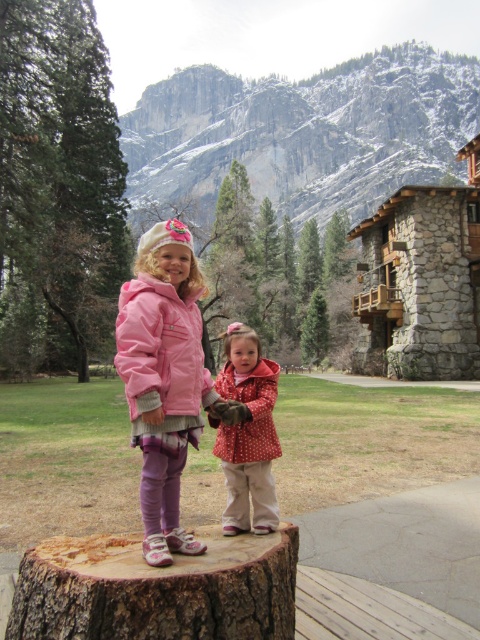
You are a photographer trying to capture a photo of the brown rough tree stump at lower center and the polka dot fabric jacket at center. Based on their heights, which object should you focus on first if you want to ensure both are in frame without adjusting your camera angle?

The brown rough tree stump at lower center is shorter than the polka dot fabric jacket at center, so you should focus on the polka dot fabric jacket at center first to ensure both are in frame.

You are a photographer trying to capture a closeup shot of both the matte pink jacket at center and the polka dot fabric jacket at center. Given that your camera has a maximum focus range of 6 feet, will you be able to capture both jackets in the same frame without moving closer?

The matte pink jacket at center and the polka dot fabric jacket at center are 6.80 feet apart. Since the distance between them exceeds the camera maximum focus range of 6 feet, you will not be able to capture both jackets in the same frame without moving closer.

You are a photographer trying to capture the two children on the brown rough tree stump at lower center and the polka dot fabric jacket at center. Which object would you focus on first if you want to highlight the smaller one?

The brown rough tree stump at lower center is smaller than the polka dot fabric jacket at center, so you should focus on the brown rough tree stump at lower center first to highlight its size.